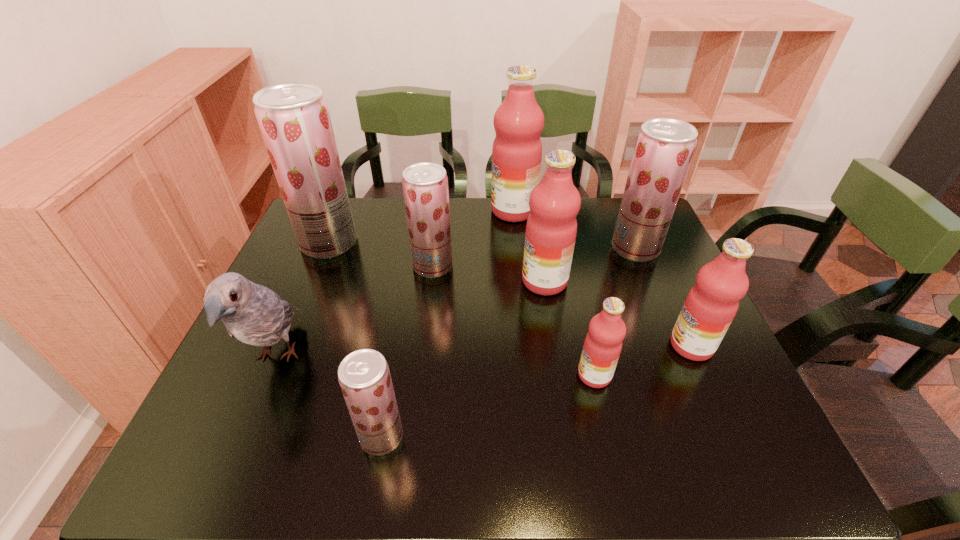
At what (x,y) coordinates should I click in order to perform the action: click on fruit juice that is positioned at the left edge. Please return your answer as a coordinate pair (x, y). The image size is (960, 540). Looking at the image, I should click on 294,120.

Locate an element on the screen. The height and width of the screenshot is (540, 960). parrot that is at the left edge is located at coordinates coord(254,314).

Where is `object that is at the far left corner`? This screenshot has width=960, height=540. object that is at the far left corner is located at coordinates (294, 120).

Find the location of a particular element. The width and height of the screenshot is (960, 540). object positioned at the far right corner is located at coordinates (664, 148).

You are a GUI agent. You are given a task and a screenshot of the screen. Output one action in this format:
    pyautogui.click(x=<x>, y=<y>)
    Task: Click on the free region at the far edge
    This screenshot has height=540, width=960.
    Given the screenshot: What is the action you would take?
    pyautogui.click(x=469, y=206)

Where is `vacant space at the near edge`? The image size is (960, 540). vacant space at the near edge is located at coordinates (348, 455).

At what (x,y) coordinates should I click in order to perform the action: click on free region at the left edge. Please return your answer as a coordinate pair (x, y). Looking at the image, I should click on (282, 339).

Where is `vacant area at the right edge of the desktop`? The width and height of the screenshot is (960, 540). vacant area at the right edge of the desktop is located at coordinates (625, 269).

Identify the location of free spot at the far left corner of the desktop. The width and height of the screenshot is (960, 540). (354, 199).

This screenshot has height=540, width=960. In order to click on unoccupied area between the rightmost pink fruit juice and the parrot in this screenshot , I will do `click(484, 352)`.